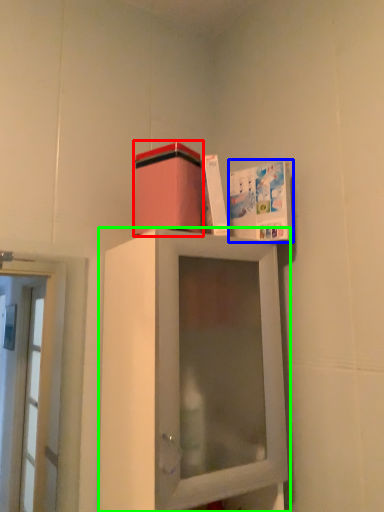
Question: Estimate the real-world distances between objects in this image. Which object is farther from cardboard box (highlighted by a red box), book cover (highlighted by a blue box) or cabinetry (highlighted by a green box)?

Choices:
 (A) book cover
 (B) cabinetry

Answer: (B)